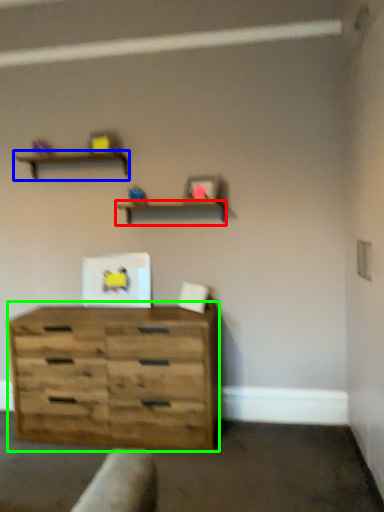
Question: Which object is the farthest from shelf (highlighted by a red box)? Choose among these: shelf (highlighted by a blue box) or chest of drawers (highlighted by a green box).

Choices:
 (A) shelf
 (B) chest of drawers

Answer: (B)